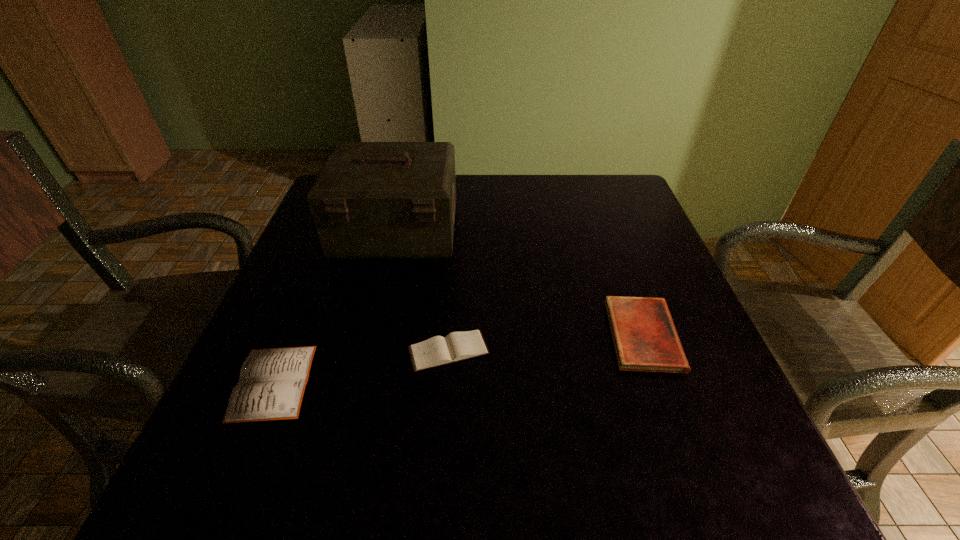
This screenshot has width=960, height=540. What are the coordinates of `the tallest object` in the screenshot? It's located at (372, 200).

At what (x,y) coordinates should I click in order to perform the action: click on the farthest object. Please return your answer as a coordinate pair (x, y). This screenshot has width=960, height=540. Looking at the image, I should click on [x=372, y=200].

Locate an element on the screen. Image resolution: width=960 pixels, height=540 pixels. the rightmost object is located at coordinates (645, 339).

Where is `the second diary from left to right`? Image resolution: width=960 pixels, height=540 pixels. the second diary from left to right is located at coordinates (437, 351).

At what (x,y) coordinates should I click in order to perform the action: click on the leftmost diary. Please return your answer as a coordinate pair (x, y). Looking at the image, I should click on (272, 382).

I want to click on free space located on the right of the tallest object, so click(585, 231).

Where is `blank area located on the left of the rightmost diary`? blank area located on the left of the rightmost diary is located at coordinates (396, 335).

This screenshot has width=960, height=540. I want to click on vacant area situated on the back of the second diary from right to left, so click(x=458, y=213).

Where is `vacant space located 0.360m on the back of the leftmost diary`? This screenshot has height=540, width=960. vacant space located 0.360m on the back of the leftmost diary is located at coordinates (336, 229).

Find the location of a particular element. object located in the far edge section of the desktop is located at coordinates (372, 200).